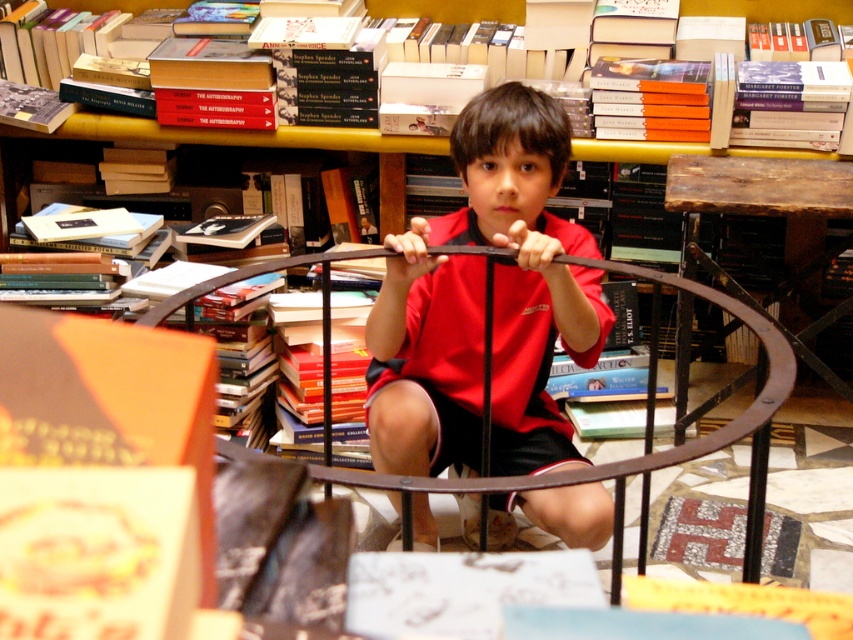
Question: Does metallic bookshelf at upper center come in front of hardcover book at upper center?

Choices:
 (A) yes
 (B) no

Answer: (A)

Question: Which of these objects is positioned farthest from the red matte shirt at center?

Choices:
 (A) rustic wood table at center
 (B) hardcover book at upper center

Answer: (B)

Question: Is metallic bookshelf at upper center in front of hardcover book at upper center?

Choices:
 (A) no
 (B) yes

Answer: (B)

Question: Estimate the real-world distances between objects in this image. Which object is farther from the hardcover book at upper center?

Choices:
 (A) rustic wood table at center
 (B) metallic bookshelf at upper center

Answer: (A)

Question: Which point is closer to the camera taking this photo?

Choices:
 (A) (256, 141)
 (B) (387, 192)
 (C) (422, 232)
 (D) (694, 214)

Answer: (C)

Question: Is metallic bookshelf at upper center bigger than rustic wood table at center?

Choices:
 (A) yes
 (B) no

Answer: (B)